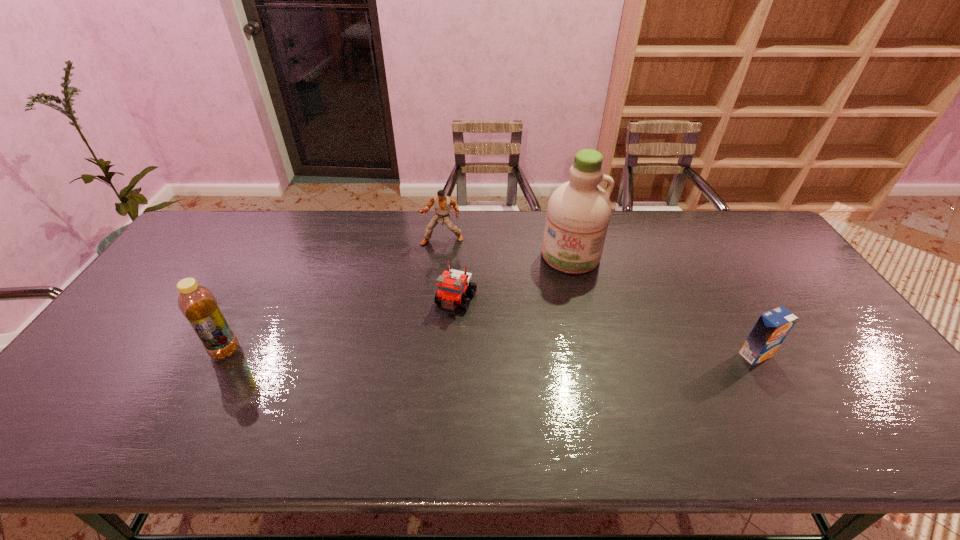
This screenshot has width=960, height=540. What are the coordinates of `vacant space located on the back of the fourth tallest object` in the screenshot? It's located at (716, 287).

Find the location of a particular element. This screenshot has width=960, height=540. free space located on the front label of the tallest object is located at coordinates (563, 341).

Locate an element on the screen. vacant space located on the front label of the tallest object is located at coordinates (561, 359).

Where is `vacant space located on the front label of the tallest object`? The height and width of the screenshot is (540, 960). vacant space located on the front label of the tallest object is located at coordinates (561, 353).

Locate an element on the screen. free space located on the front-facing side of the puncher is located at coordinates (434, 293).

Locate an element on the screen. The height and width of the screenshot is (540, 960). vacant space located 0.240m on the front-facing side of the puncher is located at coordinates (433, 298).

Where is `vacant space situated 0.240m on the front-facing side of the puncher`? The width and height of the screenshot is (960, 540). vacant space situated 0.240m on the front-facing side of the puncher is located at coordinates (433, 298).

Where is `vacant space situated on the front-facing side of the Lego`? The image size is (960, 540). vacant space situated on the front-facing side of the Lego is located at coordinates (420, 370).

I want to click on free space located 0.220m on the front-facing side of the Lego, so click(418, 377).

This screenshot has height=540, width=960. I want to click on vacant space located 0.110m on the front-facing side of the Lego, so click(434, 344).